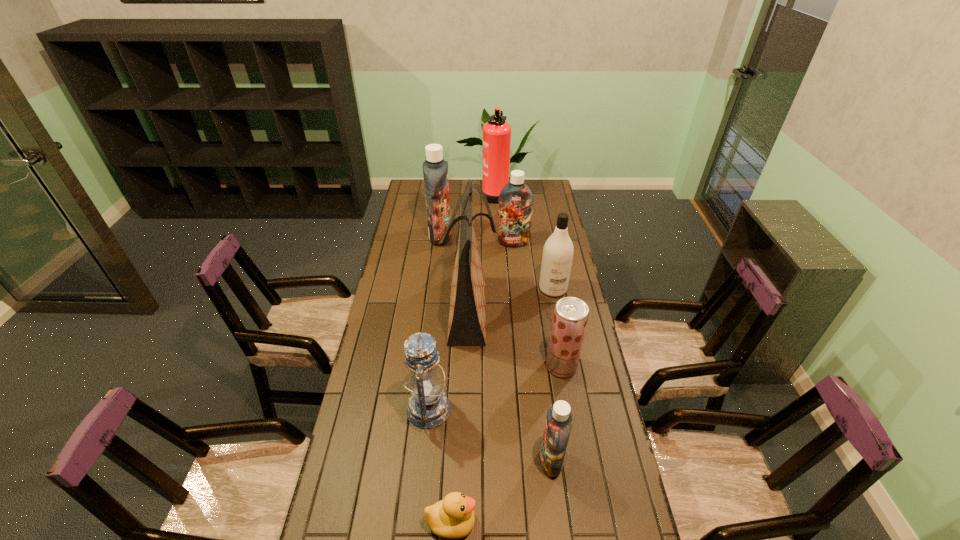
The width and height of the screenshot is (960, 540). I want to click on red fire extinguisher, so click(496, 132).

Locate an element on the screen. fire extinguisher is located at coordinates (496, 132).

The image size is (960, 540). I want to click on shopping bag, so click(x=467, y=314).

You are a GUI agent. You are given a task and a screenshot of the screen. Output one action in this format:
    pyautogui.click(x=<x>, y=<y>)
    Task: Click on the leftmost blue shampoo
    The height and width of the screenshot is (540, 960).
    Given the screenshot: What is the action you would take?
    pyautogui.click(x=435, y=170)

Locate an element on the screen. The image size is (960, 540). the leftmost shampoo is located at coordinates (435, 170).

Where is `white shampoo`? This screenshot has width=960, height=540. white shampoo is located at coordinates (557, 257).

You are a GUI agent. You are given a task and a screenshot of the screen. Output one action in this format:
    pyautogui.click(x=<x>, y=<y>)
    Task: Click on the second nearest shampoo
    
    Given the screenshot: What is the action you would take?
    pyautogui.click(x=557, y=257)

Locate an element on the screen. The height and width of the screenshot is (540, 960). the second smallest blue shampoo is located at coordinates (515, 199).

You are a GUI agent. You are given a task and a screenshot of the screen. Output one action in this format:
    pyautogui.click(x=<x>, y=<y>)
    Task: Click on the seventh farthest object
    This screenshot has height=540, width=960.
    Given the screenshot: What is the action you would take?
    pyautogui.click(x=428, y=407)

Find the location of a particular element. This screenshot has height=540, width=960. fruit juice is located at coordinates (570, 317).